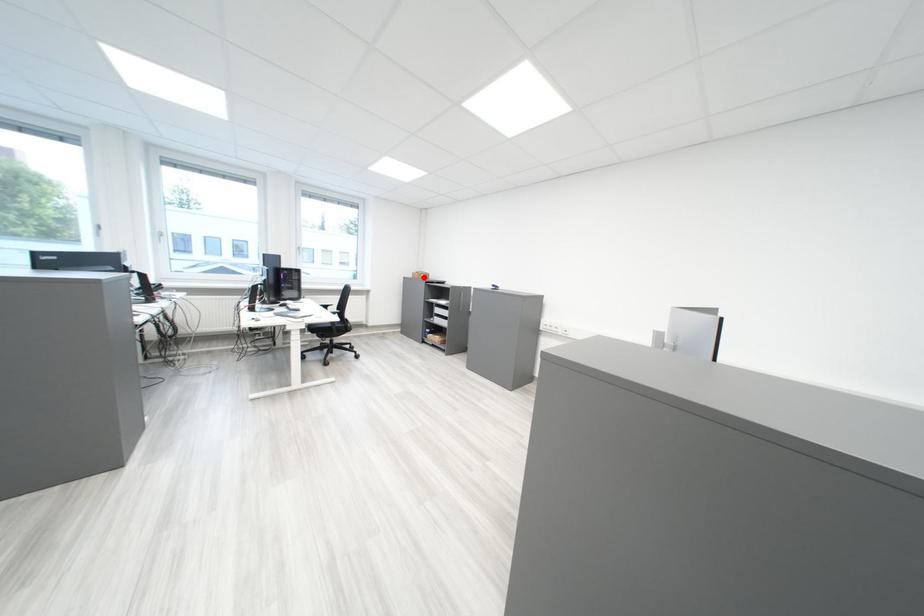
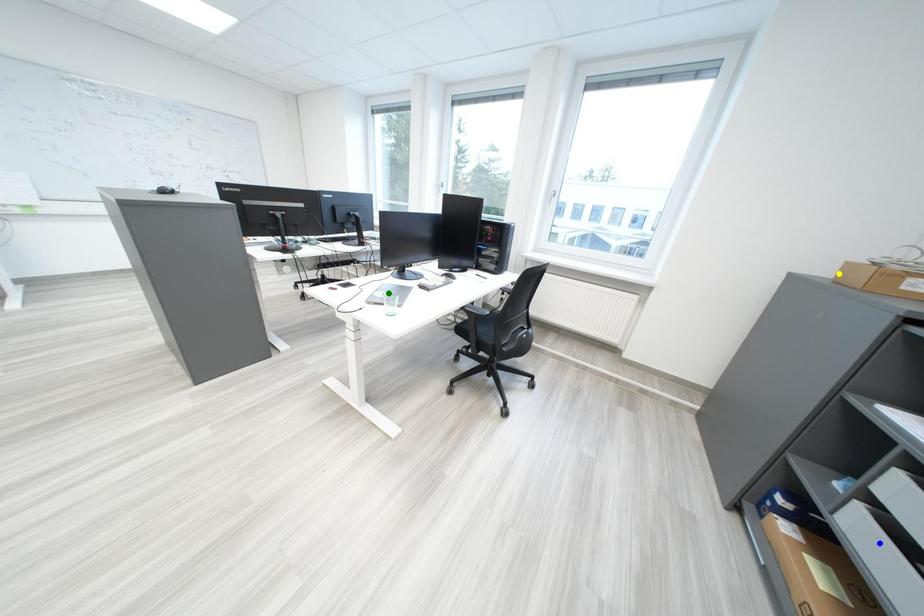
Question: I am providing you with two images of the same scene from different viewpoints. A red point is marked on the first image. You are given multiple points on the second image. Can you choose the point in image 2 that corresponds to the point in image 1?

Choices:
 (A) yellow point
 (B) blue point
 (C) green point

Answer: (A)